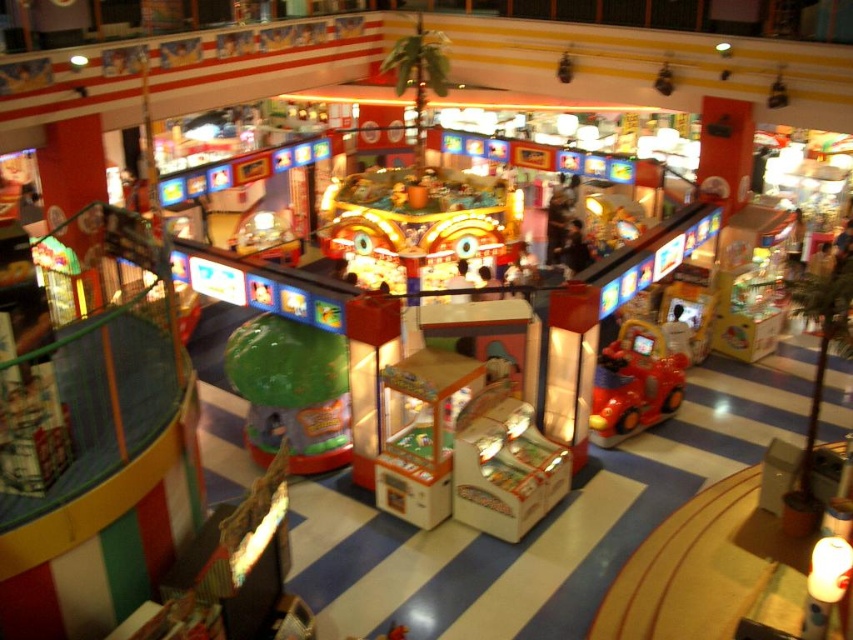
You are a maintenance worker in the arcade and need to reach both the shiny metallic claw machine at center and the shiny red plastic car at center. If your ladder is 3 meters long, can you safely reach both objects from the ground without moving the ladder?

The shiny metallic claw machine at center is 3.18 meters away from the shiny red plastic car at center. Since the ladder is only 3 meters long, it is not long enough to safely reach both objects from the ground without moving the ladder.

You are standing at the entrance of the arcade and see two points marked on the floor at coordinates point [289,369] and point [666,365]. Which point is closer to you?

Point [289,369] is in front of point [666,365], so it is closer to you.